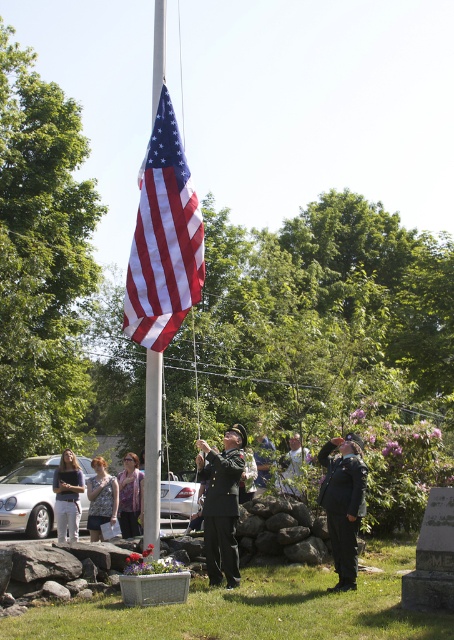
Can you confirm if light brown hair at lower left is thinner than patterned scarf at center?

Incorrect, light brown hair at lower left's width is not less than patterned scarf at center's.

From the picture: Does light brown hair at lower left appear on the left side of patterned scarf at center?

Yes, light brown hair at lower left is to the left of patterned scarf at center.

This screenshot has width=454, height=640. In order to click on light brown hair at lower left in this screenshot , I will do `click(68, 496)`.

In the scene shown: Can you confirm if matte fabric flag at center is bigger than light brown hair at lower left?

Indeed, matte fabric flag at center has a larger size compared to light brown hair at lower left.

How much distance is there between matte fabric flag at center and light brown hair at lower left?

matte fabric flag at center is 6.42 meters from light brown hair at lower left.

Who is more forward, (167,243) or (62,486)?

Positioned in front is point (167,243).

At what (x,y) coordinates should I click in order to perform the action: click on matte fabric flag at center. Please return your answer as a coordinate pair (x, y). Looking at the image, I should click on (163, 237).

Who is taller, uniformed officer at center or denim jacket at lower left?

Standing taller between the two is uniformed officer at center.

Does uniformed officer at center appear on the right side of denim jacket at lower left?

Yes, uniformed officer at center is to the right of denim jacket at lower left.

Which is behind, point (208, 461) or point (103, 493)?

Point (103, 493)

In order to click on uniformed officer at center in this screenshot , I will do point(222,504).